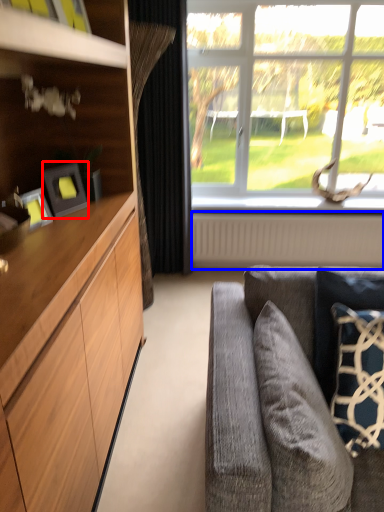
Question: Which point is closer to the camera, picture frame (highlighted by a red box) or radiator (highlighted by a blue box)?

Choices:
 (A) picture frame
 (B) radiator

Answer: (A)